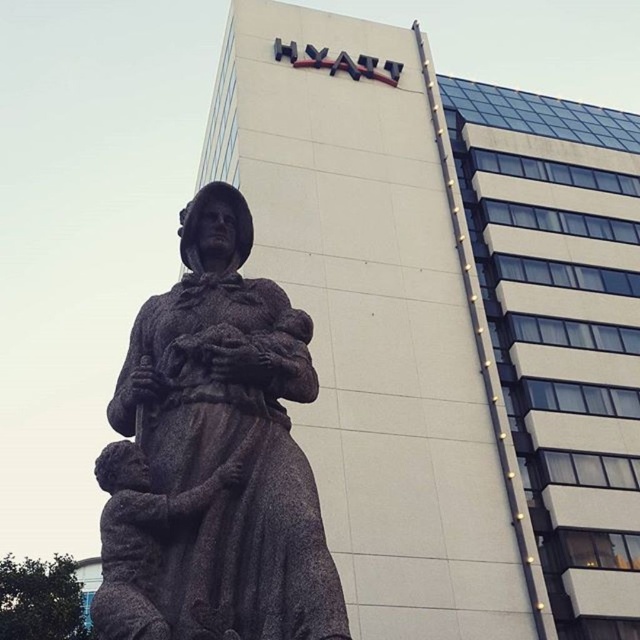
You are an art curator planning to move the brown stone statue at center and rustic stone statue at center closer together to save space. How much space will you save if you move them to touch each other?

The brown stone statue at center and rustic stone statue at center are currently 31.76 inches apart. If moved to touch each other, the saved space would be 31.76 inches.

You are standing in a park and see the brown stone statue at center. A friend asks you to describe its exact location relative to the tall modern building in the background. How would you describe it using the coordinates provided?

The brown stone statue at center is located at coordinates point (212, 458), which means it is positioned towards the right side and slightly below the center of the image, relative to the tall modern building in the background.